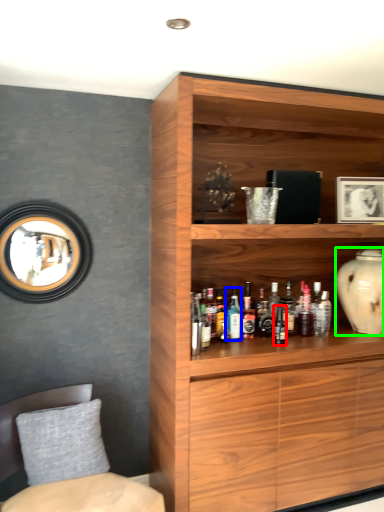
Question: Estimate the real-world distances between objects in this image. Which object is farther from bottle (highlighted by a red box), bottle (highlighted by a blue box) or vase (highlighted by a green box)?

Choices:
 (A) bottle
 (B) vase

Answer: (B)